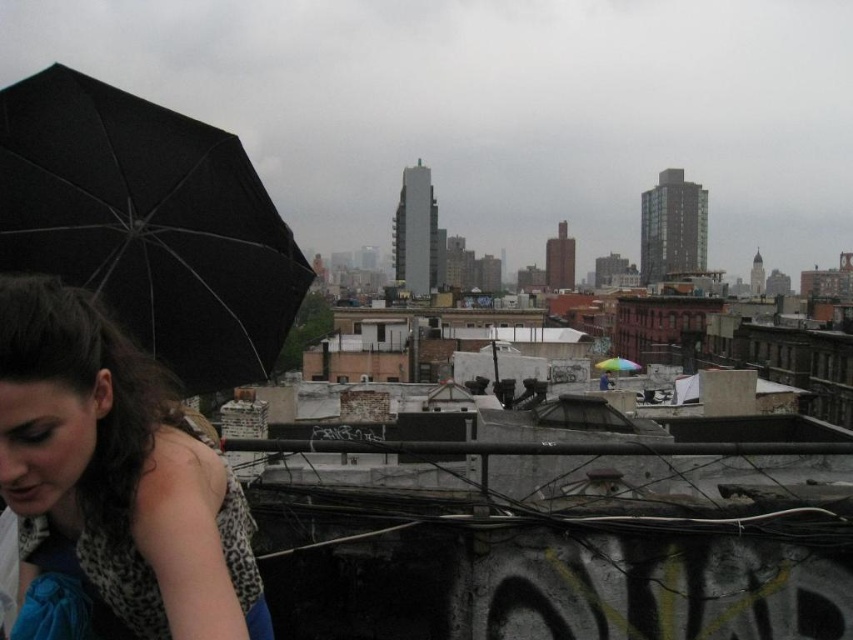
Is matte black umbrella at left positioned behind rainbow fabric umbrella at center?

No, matte black umbrella at left is in front of rainbow fabric umbrella at center.

Measure the distance from matte black umbrella at left to rainbow fabric umbrella at center.

The distance of matte black umbrella at left from rainbow fabric umbrella at center is 86.31 meters.

Between point (38, 390) and point (630, 362), which one is positioned behind?

The point (630, 362) is more distant.

Where is `matte black umbrella at left`? matte black umbrella at left is located at coordinates (117, 474).

Is black matte umbrella at left further to the viewer compared to matte black umbrella at left?

Yes, it is.

The image size is (853, 640). In order to click on black matte umbrella at left in this screenshot , I will do `click(148, 225)`.

Who is more forward, (108, 128) or (625, 360)?

Point (108, 128)

Between black matte umbrella at left and rainbow fabric umbrella at center, which one appears on the left side from the viewer's perspective?

From the viewer's perspective, black matte umbrella at left appears more on the left side.

What do you see at coordinates (148, 225) in the screenshot?
I see `black matte umbrella at left` at bounding box center [148, 225].

I want to click on black matte umbrella at left, so click(x=148, y=225).